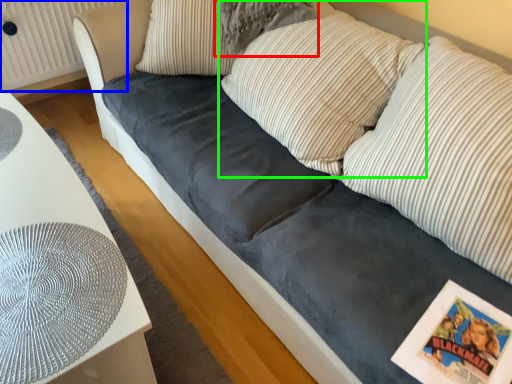
Question: Which is farther away from pillow (highlighted by a red box)? radiator (highlighted by a blue box) or pillow (highlighted by a green box)?

Choices:
 (A) radiator
 (B) pillow

Answer: (A)